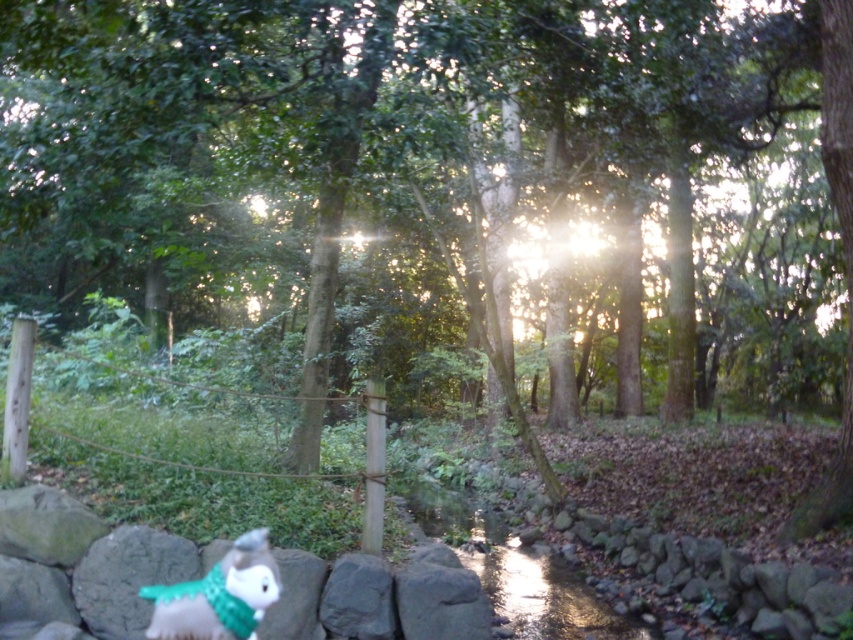
Consider the image. You are a hiker who wants to place a new sign near the fluffy gray stuffed animal at lower left without blocking the view of the shiny metallic creek at center. Based on their positions, can you place the sign in front of or behind the stuffed animal to keep the creek visible?

The shiny metallic creek at center is further to the viewer than the fluffy gray stuffed animal at lower left. To keep the creek visible, place the sign behind the stuffed animal so it doesn not block the view.